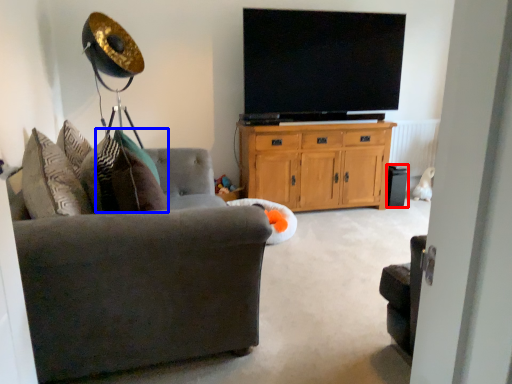
Question: Among these objects, which one is nearest to the camera, speaker (highlighted by a red box) or pillow (highlighted by a blue box)?

Choices:
 (A) speaker
 (B) pillow

Answer: (B)